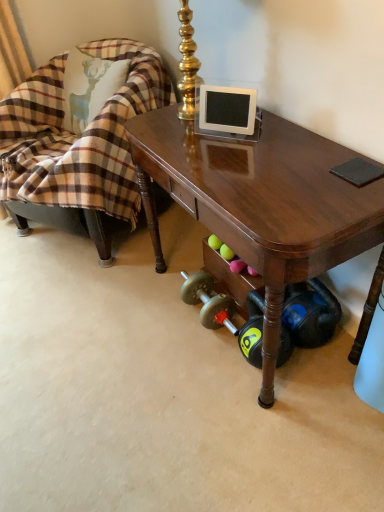
Question: In the image, is shiny brown desk at center on the left side or the right side of plaid fabric chair at left?

Choices:
 (A) left
 (B) right

Answer: (B)

Question: Looking at their shapes, would you say shiny brown desk at center is wider or thinner than plaid fabric chair at left?

Choices:
 (A) wide
 (B) thin

Answer: (B)

Question: In terms of size, does shiny brown desk at center appear bigger or smaller than plaid fabric chair at left?

Choices:
 (A) small
 (B) big

Answer: (A)

Question: From a real-world perspective, is plaid fabric chair at left physically located above or below shiny brown desk at center?

Choices:
 (A) above
 (B) below

Answer: (A)

Question: Is point click(79, 225) closer or farther from the camera than point click(188, 134)?

Choices:
 (A) closer
 (B) farther

Answer: (B)

Question: In terms of size, does plaid fabric chair at left appear bigger or smaller than shiny brown desk at center?

Choices:
 (A) big
 (B) small

Answer: (A)

Question: From the image's perspective, is plaid fabric chair at left located above or below shiny brown desk at center?

Choices:
 (A) above
 (B) below

Answer: (A)